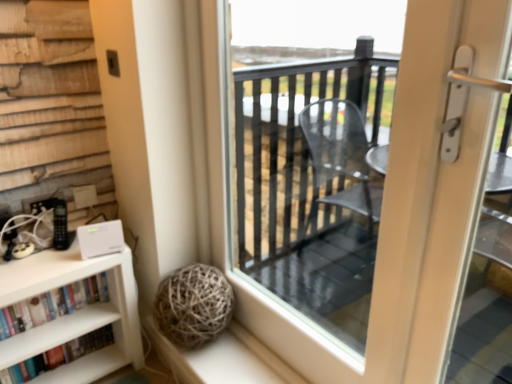
Question: From the image's perspective, relative to transparent glass door at center, is white matte bookshelf at lower left, positioned as the second book in bottom-to-top order, above or below?

Choices:
 (A) above
 (B) below

Answer: (B)

Question: Does point (36, 319) appear closer or farther from the camera than point (394, 150)?

Choices:
 (A) farther
 (B) closer

Answer: (A)

Question: Which object is the farthest from the hardcover books at lower left, placed as the second book when sorted from top to bottom?

Choices:
 (A) transparent glass door at center
 (B) white matte bookshelf at lower left, positioned as the 1th book in top-to-bottom order

Answer: (A)

Question: Estimate the real-world distances between objects in this image. Which object is closer to the white matte bookshelf at lower left, positioned as the 1th book in top-to-bottom order?

Choices:
 (A) transparent glass door at center
 (B) hardcover books at lower left, which ranks as the first book in bottom-to-top order

Answer: (B)